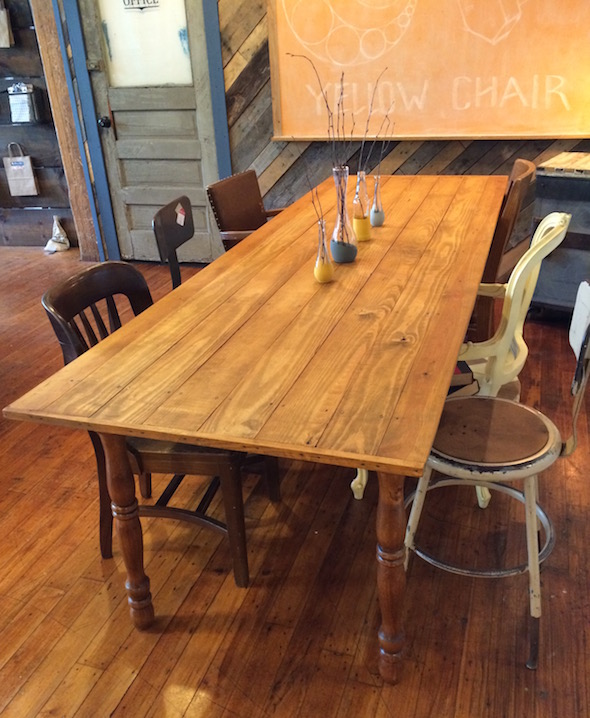
Find the location of `6 visible chairs`. 6 visible chairs is located at coordinates (240, 210), (168, 235), (120, 279), (484, 429), (506, 330), (513, 215).